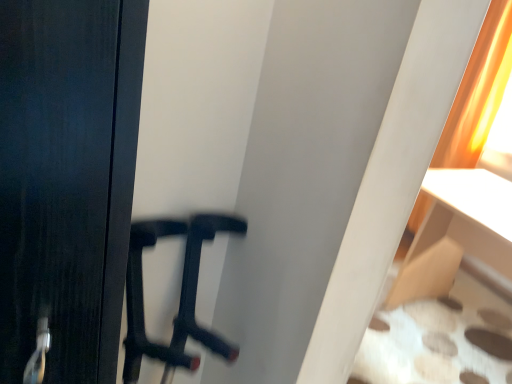
Question: From the image's perspective, is white fabric ottoman at lower right below orange fabric curtain at upper right?

Choices:
 (A) no
 (B) yes

Answer: (B)

Question: Can orange fabric curtain at upper right be found inside white fabric ottoman at lower right?

Choices:
 (A) yes
 (B) no

Answer: (B)

Question: Is white fabric ottoman at lower right positioned before orange fabric curtain at upper right?

Choices:
 (A) yes
 (B) no

Answer: (A)

Question: Is white fabric ottoman at lower right looking in the opposite direction of orange fabric curtain at upper right?

Choices:
 (A) no
 (B) yes

Answer: (A)

Question: From the image's perspective, does white fabric ottoman at lower right appear higher than orange fabric curtain at upper right?

Choices:
 (A) yes
 (B) no

Answer: (B)

Question: Considering the relative sizes of white fabric ottoman at lower right and orange fabric curtain at upper right in the image provided, is white fabric ottoman at lower right taller than orange fabric curtain at upper right?

Choices:
 (A) no
 (B) yes

Answer: (A)

Question: From a real-world perspective, is orange fabric curtain at upper right under white fabric ottoman at lower right?

Choices:
 (A) yes
 (B) no

Answer: (B)

Question: Is orange fabric curtain at upper right taller than white fabric ottoman at lower right?

Choices:
 (A) no
 (B) yes

Answer: (B)

Question: Can you confirm if orange fabric curtain at upper right is wider than white fabric ottoman at lower right?

Choices:
 (A) yes
 (B) no

Answer: (B)

Question: Is white fabric ottoman at lower right at the back of orange fabric curtain at upper right?

Choices:
 (A) yes
 (B) no

Answer: (B)

Question: Is orange fabric curtain at upper right directly adjacent to white fabric ottoman at lower right?

Choices:
 (A) yes
 (B) no

Answer: (B)

Question: Does orange fabric curtain at upper right turn towards white fabric ottoman at lower right?

Choices:
 (A) no
 (B) yes

Answer: (A)

Question: Relative to white fabric ottoman at lower right, is orange fabric curtain at upper right in front or behind?

Choices:
 (A) behind
 (B) front

Answer: (A)